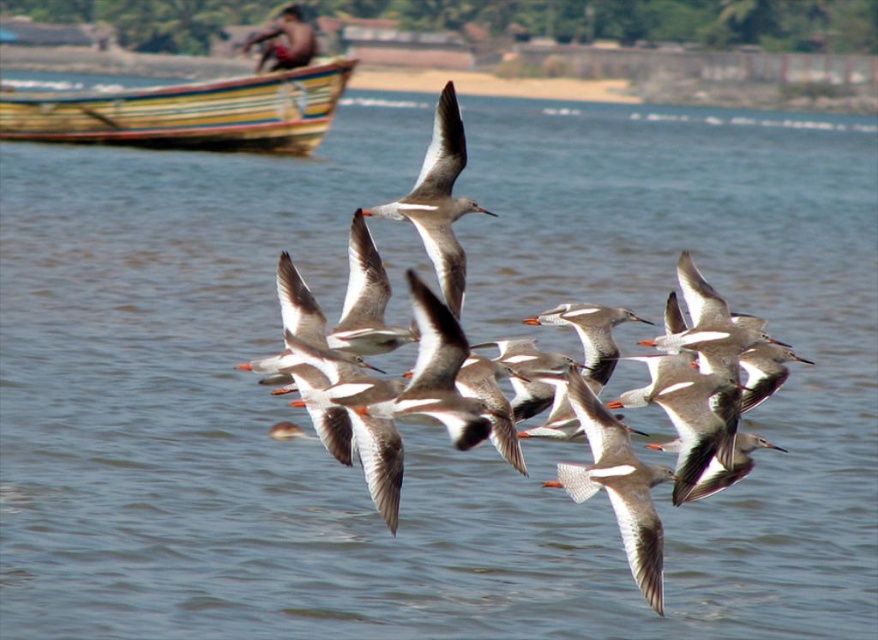
You are a photographer trying to capture a closeup shot of the white matte bird at center while also including the wooden painted boat at upper left in the frame. Given their sizes, will you need to adjust your camera settings to focus on both objects simultaneously?

Since the wooden painted boat at upper left is larger than the white matte bird at center, you will need to adjust your camera settings to ensure both are in focus. The larger boat may require a different focal length or depth of field adjustment to capture both subjects clearly.

You are a birdwatcher observing two birds in the sky. You notice a white feathered bird at center and a white matte bird at center. Which bird appears smaller in size?

The white feathered bird at center appears smaller in size compared to the white matte bird at center since it has a lesser width.

You are a photographer trying to capture a photo of the white feathered bird at center. You notice the wooden painted boat at upper left in the background. To avoid the boat from blocking the bird, should you move to your right or left?

You should move to your right to avoid the wooden painted boat at upper left blocking the white feathered bird at center since the boat is to the left of the bird.